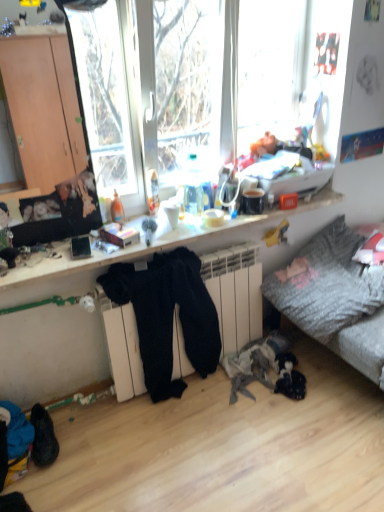
Locate an element on the screen. vacant space that is in between black suede shoes at lower left and black fuzzy pants at center is located at coordinates (112, 423).